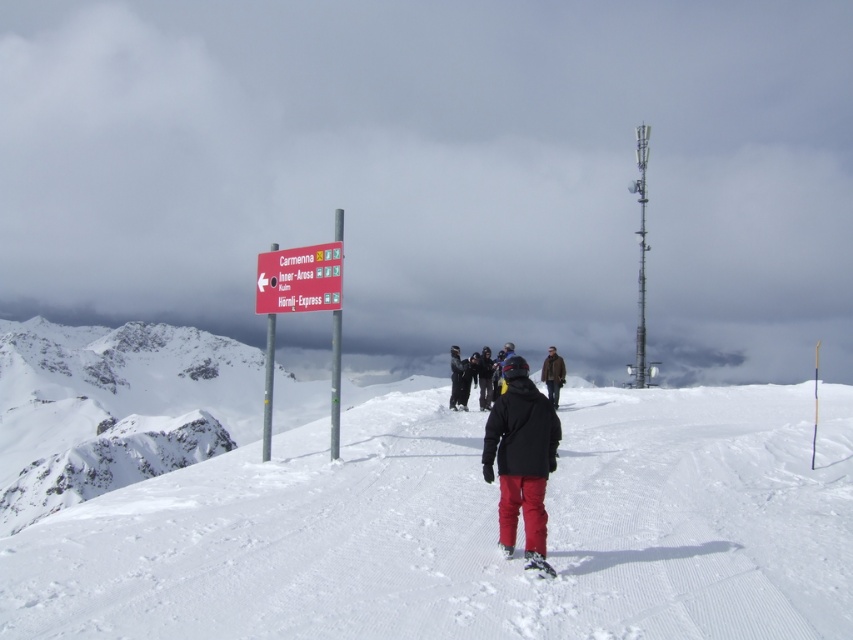
Is brown leather jacket at center below black matte jacket at center?

Correct, brown leather jacket at center is located below black matte jacket at center.

Can you confirm if brown leather jacket at center is positioned to the right of black matte jacket at center?

Indeed, brown leather jacket at center is positioned on the right side of black matte jacket at center.

What do you see at coordinates (553, 374) in the screenshot?
I see `brown leather jacket at center` at bounding box center [553, 374].

This screenshot has width=853, height=640. I want to click on brown leather jacket at center, so click(x=553, y=374).

Can you confirm if cloudy sky at upper center is positioned to the left of black matte jacket at center?

Correct, you'll find cloudy sky at upper center to the left of black matte jacket at center.

Measure the distance between cloudy sky at upper center and black matte jacket at center.

The distance of cloudy sky at upper center from black matte jacket at center is 174.44 meters.

Describe the element at coordinates (442, 173) in the screenshot. The height and width of the screenshot is (640, 853). I see `cloudy sky at upper center` at that location.

What are the coordinates of `cloudy sky at upper center` in the screenshot? It's located at (442, 173).

Which is in front, point (338, 276) or point (529, 561)?

Point (529, 561)

Between point (274, 305) and point (531, 554), which one is positioned in front?

Point (531, 554)

You are a GUI agent. You are given a task and a screenshot of the screen. Output one action in this format:
    pyautogui.click(x=<x>, y=<y>)
    Task: Click on the red plastic sign at center
    
    Given the screenshot: What is the action you would take?
    pyautogui.click(x=299, y=278)